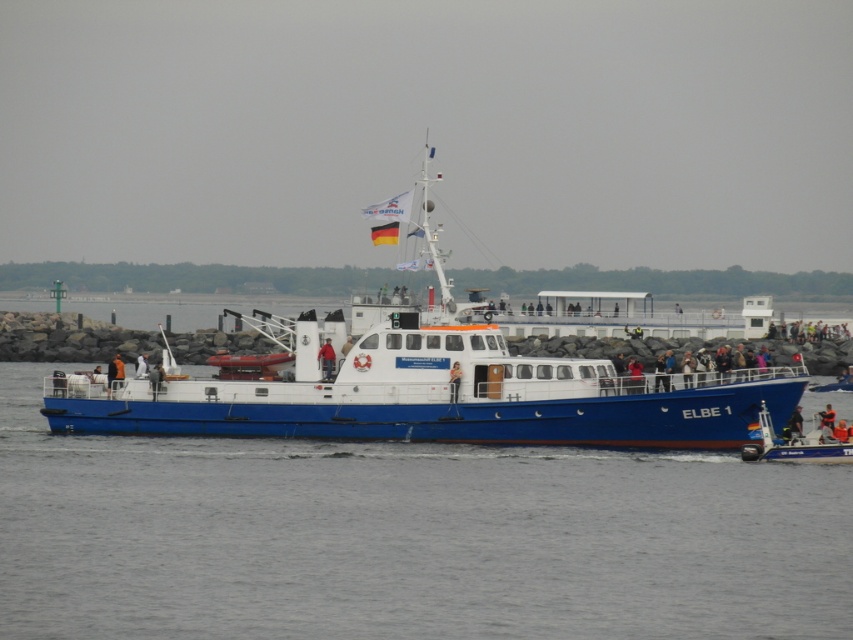
Who is more forward, [485,346] or [450,372]?

Point [450,372] is more forward.

From the picture: Can you confirm if blue matte boat at center is thinner than orange life vest at center?

In fact, blue matte boat at center might be wider than orange life vest at center.

The height and width of the screenshot is (640, 853). What do you see at coordinates (428, 390) in the screenshot? I see `blue matte boat at center` at bounding box center [428, 390].

Where is `blue matte boat at center`? The height and width of the screenshot is (640, 853). blue matte boat at center is located at coordinates (428, 390).

Identify the location of blue matte boat at center. This screenshot has height=640, width=853. (428, 390).

Is blue matte boat at center below red fabric jacket at center?

Incorrect, blue matte boat at center is not positioned below red fabric jacket at center.

Which is behind, point (397, 364) or point (323, 353)?

The point (397, 364) is behind.

Where is `blue matte boat at center`? Image resolution: width=853 pixels, height=640 pixels. blue matte boat at center is located at coordinates (428, 390).

Does red fabric jacket at center come behind orange life vest at lower right?

Yes, it is behind orange life vest at lower right.

Can you confirm if red fabric jacket at center is thinner than orange life vest at lower right?

Yes, red fabric jacket at center is thinner than orange life vest at lower right.

Locate an element on the screen. This screenshot has width=853, height=640. red fabric jacket at center is located at coordinates (326, 358).